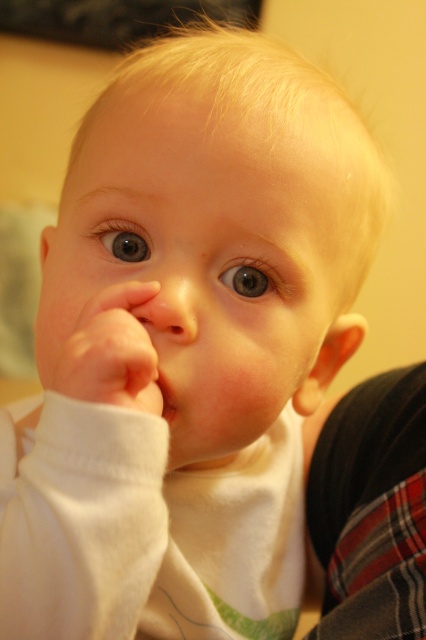
Can you confirm if white soft hand at center is positioned to the left of pink smooth lips at center?

Correct, you'll find white soft hand at center to the left of pink smooth lips at center.

Can you confirm if white soft hand at center is positioned to the right of pink smooth lips at center?

Incorrect, white soft hand at center is not on the right side of pink smooth lips at center.

Between point (86, 348) and point (173, 392), which one is positioned behind?

Point (173, 392)

I want to click on white soft hand at center, so click(x=111, y=353).